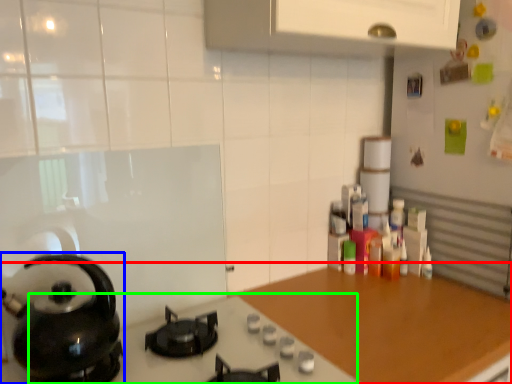
Question: Estimate the real-world distances between objects in this image. Which object is farther from countertop (highlighted by a red box), kitchen appliance (highlighted by a blue box) or gas stove (highlighted by a green box)?

Choices:
 (A) kitchen appliance
 (B) gas stove

Answer: (A)